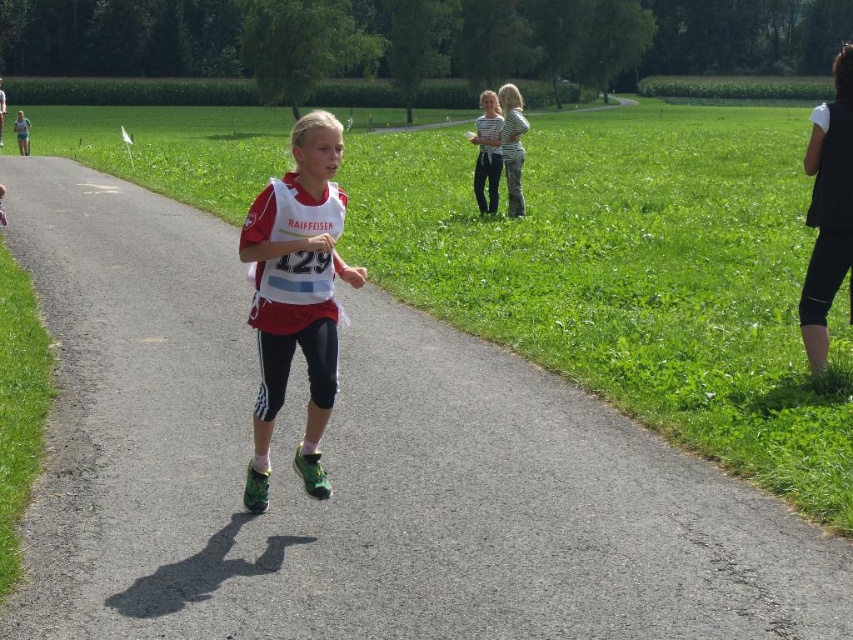
Is matte red and white bib at center to the left of striped cotton shirt at upper center from the viewer's perspective?

Correct, you'll find matte red and white bib at center to the left of striped cotton shirt at upper center.

Consider the image. Between matte red and white bib at center and striped cotton shirt at upper center, which one appears on the right side from the viewer's perspective?

From the viewer's perspective, striped cotton shirt at upper center appears more on the right side.

Locate an element on the screen. matte red and white bib at center is located at coordinates (296, 296).

Can you confirm if black matte vest at right is bigger than striped fabric shirt at upper center?

Indeed, black matte vest at right has a larger size compared to striped fabric shirt at upper center.

Between point (844, 140) and point (505, 93), which one is positioned behind?

The point (505, 93) is more distant.

Measure the distance between black matte vest at right and camera.

7.37 meters

You are a GUI agent. You are given a task and a screenshot of the screen. Output one action in this format:
    pyautogui.click(x=<x>, y=<y>)
    Task: Click on the black matte vest at right
    This screenshot has width=853, height=640.
    Given the screenshot: What is the action you would take?
    pyautogui.click(x=828, y=211)

Which is behind, point (480, 161) or point (512, 211)?

Point (512, 211)

Which of these two, striped cotton shirt at upper center or striped fabric shirt at upper center, stands taller?

With more height is striped fabric shirt at upper center.

Describe the element at coordinates (486, 152) in the screenshot. I see `striped cotton shirt at upper center` at that location.

Identify the location of striped cotton shirt at upper center. (486, 152).